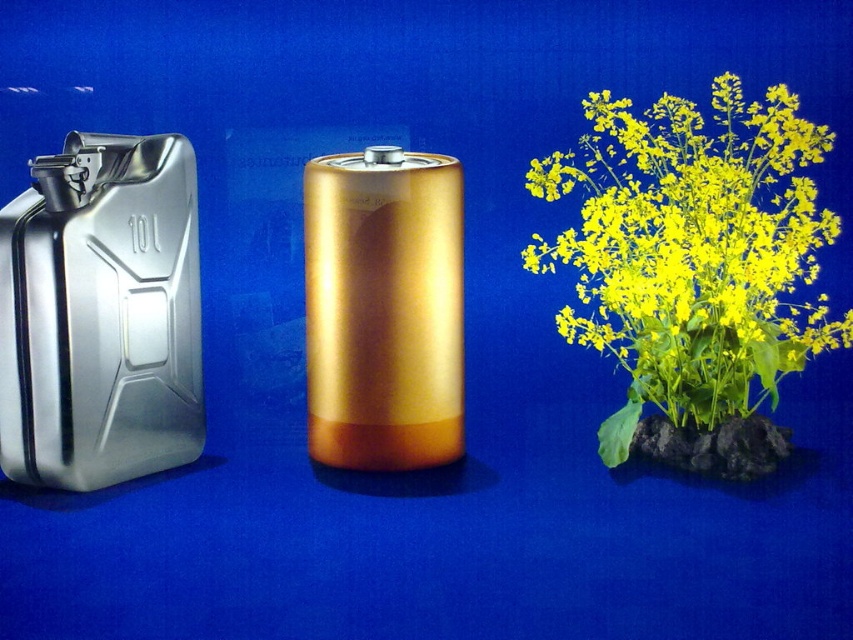
Which is below, yellow matte plant at center or brushed metal canister at left?

brushed metal canister at left is lower down.

Is yellow matte plant at center bigger than brushed metal canister at left?

Indeed, yellow matte plant at center has a larger size compared to brushed metal canister at left.

Find the location of a particular element. This screenshot has width=853, height=640. yellow matte plant at center is located at coordinates (692, 252).